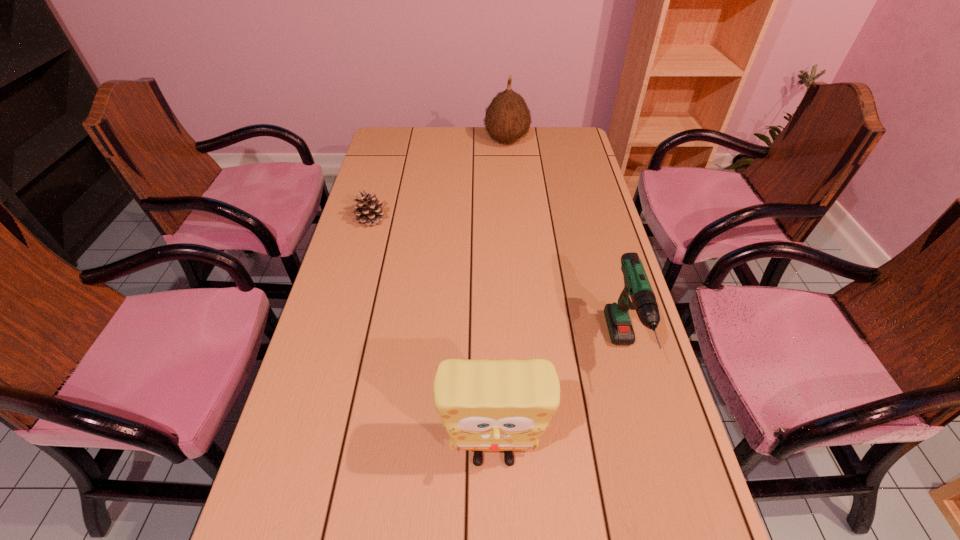
Find the location of a particular element. vacant space situated 0.160m on the back of the shortest object is located at coordinates (381, 183).

In order to click on object positioned at the far edge in this screenshot , I will do `click(507, 118)`.

The height and width of the screenshot is (540, 960). In order to click on object present at the left edge in this screenshot , I will do `click(368, 211)`.

At what (x,y) coordinates should I click in order to perform the action: click on object situated at the right edge. Please return your answer as a coordinate pair (x, y). The width and height of the screenshot is (960, 540). Looking at the image, I should click on (637, 294).

Locate an element on the screen. The height and width of the screenshot is (540, 960). vacant space at the far edge of the desktop is located at coordinates (531, 153).

Where is `vacant space at the left edge of the desktop`? The width and height of the screenshot is (960, 540). vacant space at the left edge of the desktop is located at coordinates (383, 323).

This screenshot has height=540, width=960. What are the coordinates of `vacant region at the right edge of the desktop` in the screenshot? It's located at (646, 444).

Identify the location of free spot at the far left corner of the desktop. (382, 150).

This screenshot has height=540, width=960. What are the coordinates of `free space between the pinecone and the nearest object` in the screenshot? It's located at (432, 338).

Where is `free space that is in between the coconut and the pinecone`? The height and width of the screenshot is (540, 960). free space that is in between the coconut and the pinecone is located at coordinates (439, 180).